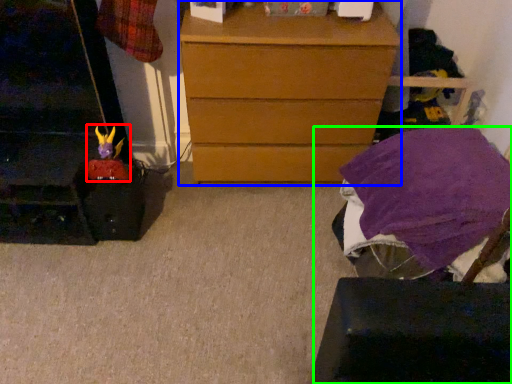
Question: Which object is positioned closest to toy (highlighted by a red box)? Select from chest of drawers (highlighted by a blue box) and furniture (highlighted by a green box).

Choices:
 (A) chest of drawers
 (B) furniture

Answer: (A)